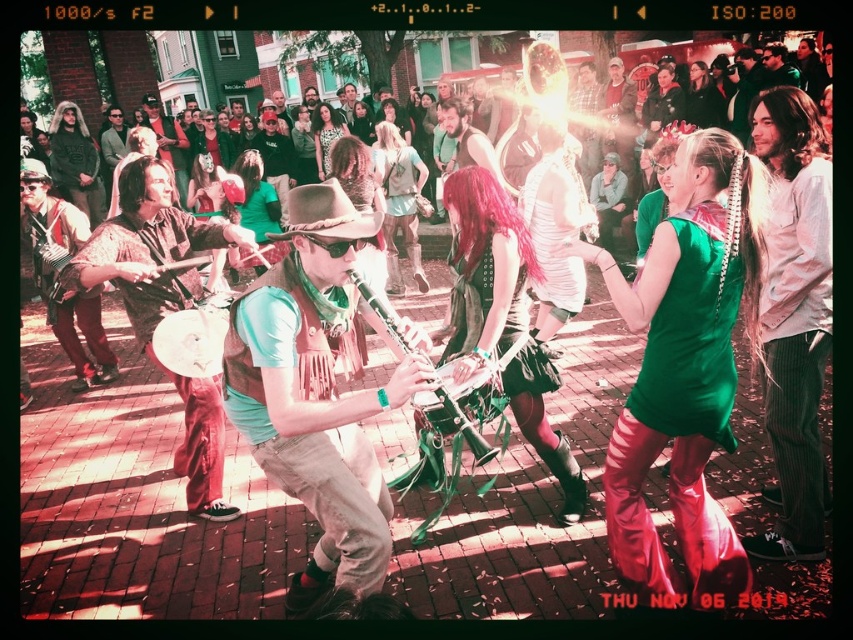
You are a photographer standing in front of the street performers. You want to take a photo that focuses on the matte green shirt at center and the metallic green clarinet at center. Which object will appear larger in your photo?

The matte green shirt at center will appear larger in the photo because it is closer to the viewer than the metallic green clarinet at center.